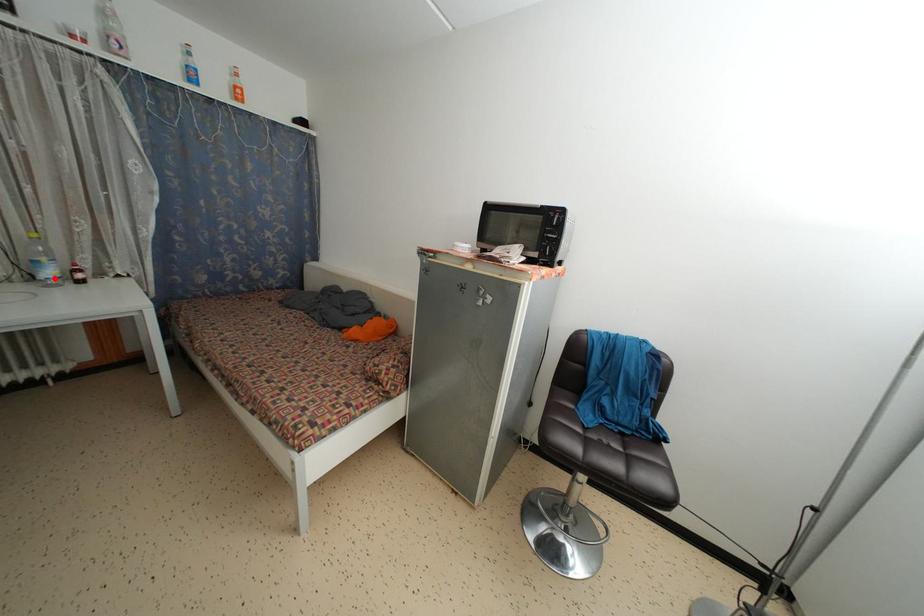
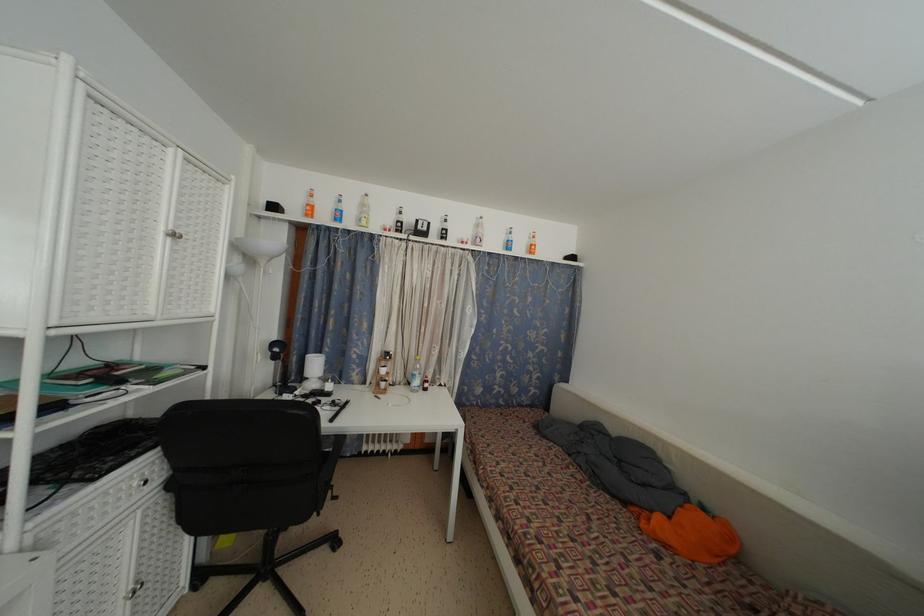
The point at the highlighted location is marked in the first image. Where is the corresponding point in the second image?

(420, 387)